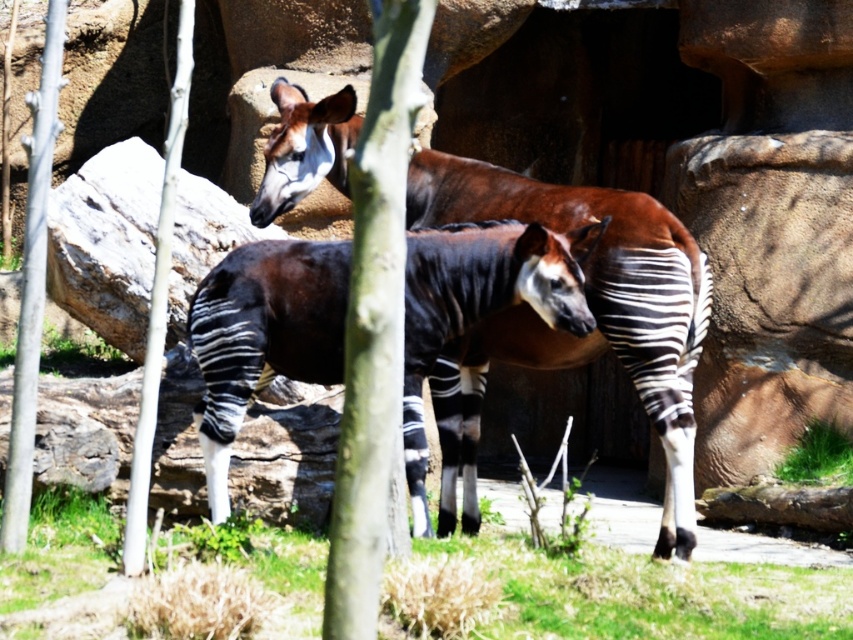
Question: Is smooth gray tree trunk at left to the left of smooth bark tree at left from the viewer's perspective?

Choices:
 (A) yes
 (B) no

Answer: (A)

Question: Is black and white striped okapi at center positioned before smooth bark tree at left?

Choices:
 (A) yes
 (B) no

Answer: (B)

Question: Which point appears closest to the camera in this image?

Choices:
 (A) (32, 276)
 (B) (183, 76)

Answer: (B)

Question: Which object is positioned closest to the zebra-striped okapi at center?

Choices:
 (A) smooth gray tree trunk at left
 (B) green bark tree at center
 (C) smooth bark tree at left
 (D) black and white striped okapi at center

Answer: (D)

Question: Can you confirm if green bark tree at center is bigger than smooth gray tree trunk at left?

Choices:
 (A) no
 (B) yes

Answer: (A)

Question: Which of the following is the farthest from the observer?

Choices:
 (A) black and white striped okapi at center
 (B) smooth gray tree trunk at left

Answer: (A)